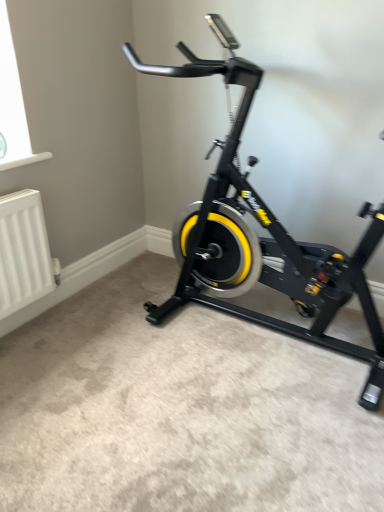
Image resolution: width=384 pixels, height=512 pixels. I want to click on vacant area situated to the left side of black matte stationary bicycle at center, so click(109, 348).